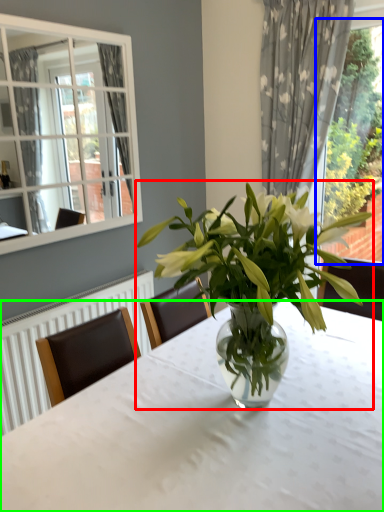
Question: Estimate the real-world distances between objects in this image. Which object is closer to houseplant (highlighted by a red box), bay window (highlighted by a blue box) or table (highlighted by a green box)?

Choices:
 (A) bay window
 (B) table

Answer: (B)